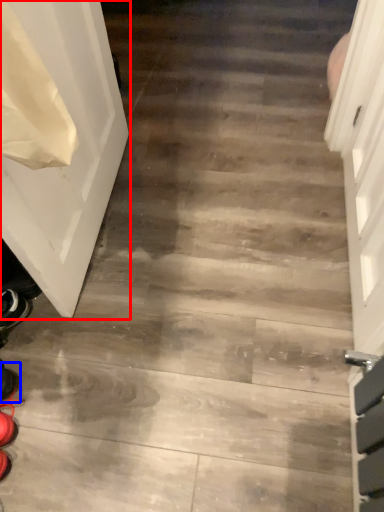
Question: Among these objects, which one is farthest to the camera, door (highlighted by a red box) or shoe (highlighted by a blue box)?

Choices:
 (A) door
 (B) shoe

Answer: (B)